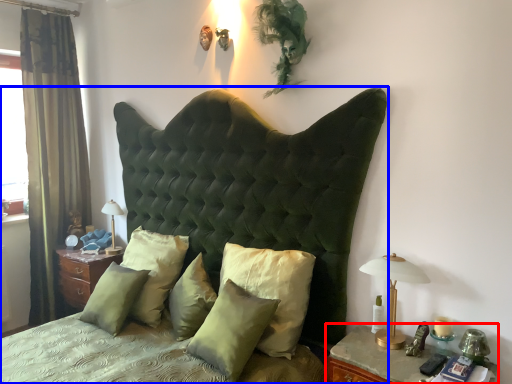
Question: Which object appears closest to the camera in this image, nightstand (highlighted by a red box) or bed (highlighted by a blue box)?

Choices:
 (A) nightstand
 (B) bed

Answer: (B)